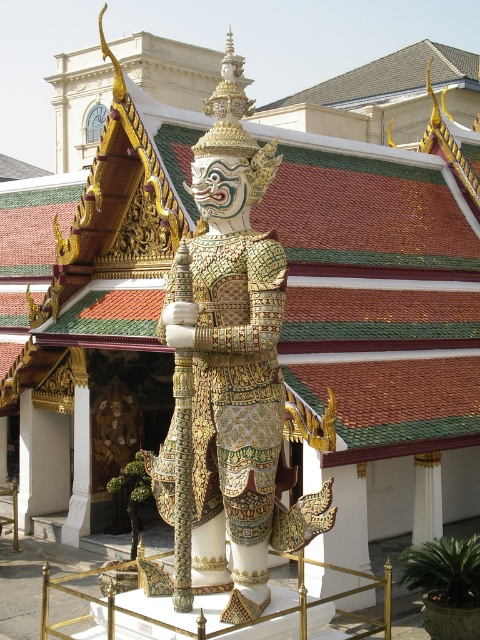
Question: Which object is closer to the camera taking this photo?

Choices:
 (A) white marble pillar at center
 (B) gold textured armor at center

Answer: (B)

Question: Among these points, which one is farthest from the camera?

Choices:
 (A) tap(189, 310)
 (B) tap(421, 520)

Answer: (B)

Question: Can you confirm if gold textured armor at center is positioned to the right of white marble pillar at center?

Choices:
 (A) no
 (B) yes

Answer: (A)

Question: Which object is closer to the camera taking this photo?

Choices:
 (A) white marble pillar at center
 (B) gold textured armor at center

Answer: (B)

Question: Can you confirm if gold textured armor at center is bigger than white marble pillar at center?

Choices:
 (A) yes
 (B) no

Answer: (A)

Question: Does gold textured armor at center have a greater width compared to white marble pillar at center?

Choices:
 (A) no
 (B) yes

Answer: (B)